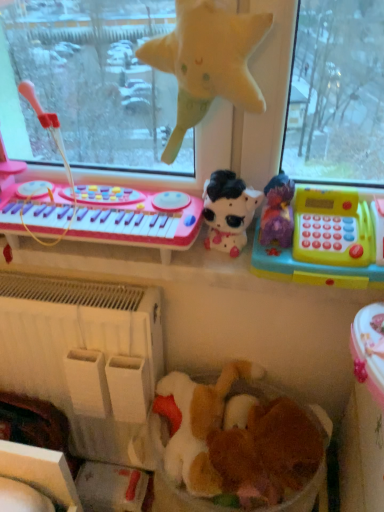
Question: Is fluffy white stuffed animal at center, which is the fourth toy from top to bottom, directly adjacent to pink plastic musical keyboard at left?

Choices:
 (A) yes
 (B) no

Answer: (B)

Question: From a real-world perspective, is fluffy white stuffed animal at center, which is the fourth toy from top to bottom, located beneath pink plastic musical keyboard at left?

Choices:
 (A) no
 (B) yes

Answer: (B)

Question: Considering the relative sizes of fluffy white stuffed animal at center, which is the fourth toy from top to bottom, and pink plastic musical keyboard at left in the image provided, is fluffy white stuffed animal at center, which is the fourth toy from top to bottom, thinner than pink plastic musical keyboard at left?

Choices:
 (A) yes
 (B) no

Answer: (B)

Question: From a real-world perspective, does fluffy white stuffed animal at center, the second toy from the bottom, stand above pink plastic musical keyboard at left?

Choices:
 (A) yes
 (B) no

Answer: (B)

Question: From the image's perspective, is fluffy white stuffed animal at center, the second toy from the bottom, beneath pink plastic musical keyboard at left?

Choices:
 (A) no
 (B) yes

Answer: (B)

Question: In the image, is plush black and white cow at center, arranged as the 2th toy when viewed from the top, positioned in front of or behind white plastic radiator at lower left?

Choices:
 (A) front
 (B) behind

Answer: (A)

Question: Considering the relative positions of plush black and white cow at center, arranged as the 2th toy when viewed from the top, and white plastic radiator at lower left in the image provided, is plush black and white cow at center, arranged as the 2th toy when viewed from the top, to the left or to the right of white plastic radiator at lower left?

Choices:
 (A) right
 (B) left

Answer: (A)

Question: Looking at the image, does plush black and white cow at center, arranged as the 2th toy when viewed from the top, seem bigger or smaller compared to white plastic radiator at lower left?

Choices:
 (A) small
 (B) big

Answer: (A)

Question: In terms of height, does plush black and white cow at center, positioned as the fourth toy in bottom-to-top order, look taller or shorter compared to white plastic radiator at lower left?

Choices:
 (A) tall
 (B) short

Answer: (B)

Question: Which is correct: fuzzy brown teddy bear at center, positioned as the 1th toy in bottom-to-top order, is inside plush black and white cow at center, arranged as the 2th toy when viewed from the top, or outside of it?

Choices:
 (A) outside
 (B) inside

Answer: (A)

Question: Looking at the image, does fuzzy brown teddy bear at center, which appears as the fifth toy when viewed from the top, seem bigger or smaller compared to plush black and white cow at center, arranged as the 2th toy when viewed from the top?

Choices:
 (A) big
 (B) small

Answer: (A)

Question: Is point (266, 419) positioned closer to the camera than point (236, 189)?

Choices:
 (A) closer
 (B) farther

Answer: (B)

Question: Visually, is fuzzy brown teddy bear at center, which appears as the fifth toy when viewed from the top, positioned to the left or to the right of plush black and white cow at center, arranged as the 2th toy when viewed from the top?

Choices:
 (A) right
 (B) left

Answer: (A)

Question: Is fluffy white stuffed animal at center, the second toy from the bottom, to the left or to the right of fuzzy brown teddy bear at center, positioned as the 1th toy in bottom-to-top order, in the image?

Choices:
 (A) right
 (B) left

Answer: (B)

Question: In terms of size, does fluffy white stuffed animal at center, which is the fourth toy from top to bottom, appear bigger or smaller than fuzzy brown teddy bear at center, positioned as the 1th toy in bottom-to-top order?

Choices:
 (A) big
 (B) small

Answer: (A)